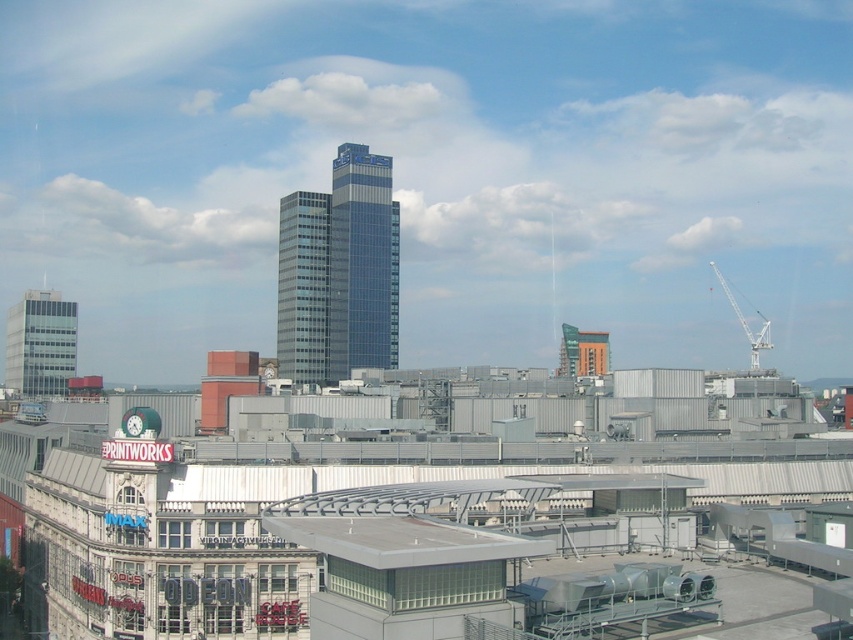
Question: Is glassy blue skyscraper at center wider than orange brick building at center?

Choices:
 (A) yes
 (B) no

Answer: (A)

Question: Is orange brick building at center wider than white metallic crane at upper right?

Choices:
 (A) yes
 (B) no

Answer: (B)

Question: Which of the following is the farthest from the observer?

Choices:
 (A) (15, 356)
 (B) (573, 340)

Answer: (A)

Question: Which point is closer to the camera taking this photo?

Choices:
 (A) (289, 312)
 (B) (35, 300)
 (C) (584, 333)

Answer: (C)

Question: Can you confirm if gray metallic roof at center is wider than matte glass building at left?

Choices:
 (A) no
 (B) yes

Answer: (A)

Question: Which point appears farthest from the camera in this image?

Choices:
 (A) (370, 195)
 (B) (302, 536)
 (C) (593, 332)

Answer: (A)